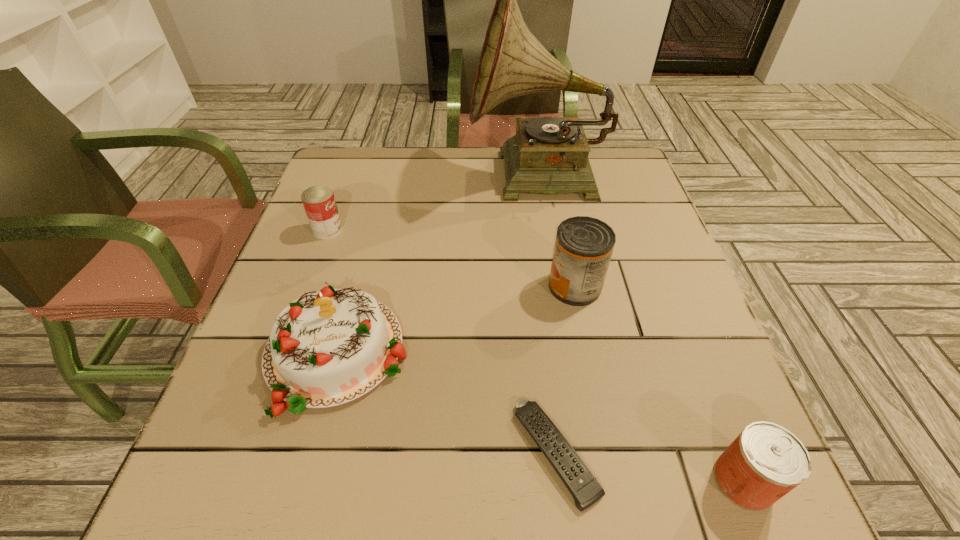
The width and height of the screenshot is (960, 540). I want to click on remote control that is positioned at the near edge, so click(585, 489).

I want to click on cake that is at the left edge, so click(326, 348).

Locate an element on the screen. This screenshot has height=540, width=960. can positioned at the left edge is located at coordinates (319, 203).

The height and width of the screenshot is (540, 960). I want to click on record player that is at the right edge, so click(549, 155).

You are a GUI agent. You are given a task and a screenshot of the screen. Output one action in this format:
    pyautogui.click(x=<x>, y=<y>)
    Task: Click on the can positioned at the right edge
    
    Given the screenshot: What is the action you would take?
    pyautogui.click(x=766, y=461)

Locate an element on the screen. The height and width of the screenshot is (540, 960). object that is positioned at the far right corner is located at coordinates (549, 155).

Locate an element on the screen. The height and width of the screenshot is (540, 960). object positioned at the near right corner is located at coordinates (766, 461).

This screenshot has height=540, width=960. In the image, there is a desktop. Find the location of `vacant region at the far edge`. vacant region at the far edge is located at coordinates 436,166.

What are the coordinates of `vacant space at the near edge of the desktop` in the screenshot? It's located at (398, 485).

The height and width of the screenshot is (540, 960). In the image, there is a desktop. In order to click on vacant region at the left edge in this screenshot , I will do point(263,315).